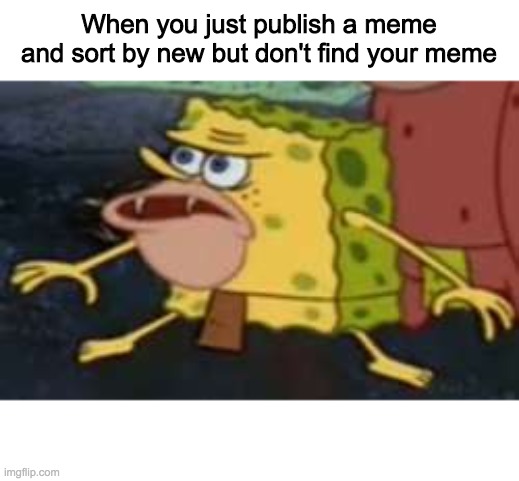
You are a GUI agent. You are given a task and a screenshot of the screen. Output one action in this format:
    pyautogui.click(x=<x>, y=<y>)
    Task: Click on the cabinet
    
    Given the screenshot: What is the action you would take?
    pyautogui.click(x=472, y=145)